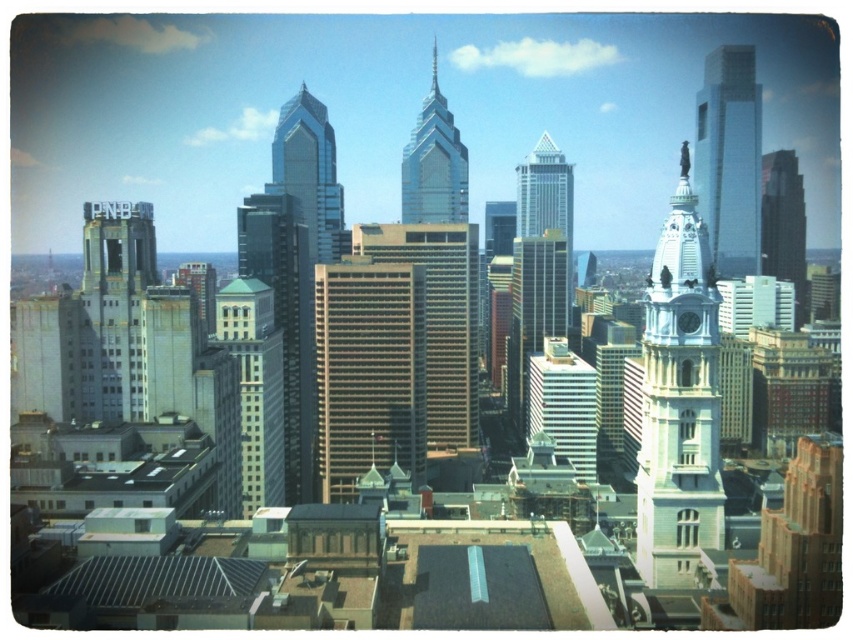
Which is below, light gray stone building at center-left or glassy silver skyscraper at center?

light gray stone building at center-left is below.

Does light gray stone building at center-left have a smaller size compared to glassy silver skyscraper at center?

Incorrect, light gray stone building at center-left is not smaller in size than glassy silver skyscraper at center.

This screenshot has height=640, width=853. What are the coordinates of `light gray stone building at center-left` in the screenshot? It's located at (254, 387).

Does point (341, 208) lie in front of point (428, 173)?

No, it is not.

Between glassy reflective skyscraper at center and glassy silver skyscraper at center, which one appears on the left side from the viewer's perspective?

glassy reflective skyscraper at center

Is point (325, 244) positioned behind point (444, 163)?

No, it is not.

I want to click on glassy reflective skyscraper at center, so click(x=309, y=172).

Is shiny glass skyscraper at center-right above silver glass skyscraper at center?

Incorrect, shiny glass skyscraper at center-right is not positioned above silver glass skyscraper at center.

Does shiny glass skyscraper at center-right come in front of silver glass skyscraper at center?

No.

Is point (799, 280) closer to camera compared to point (544, 216)?

No.

Where is `shiny glass skyscraper at center-right`? shiny glass skyscraper at center-right is located at coordinates (784, 225).